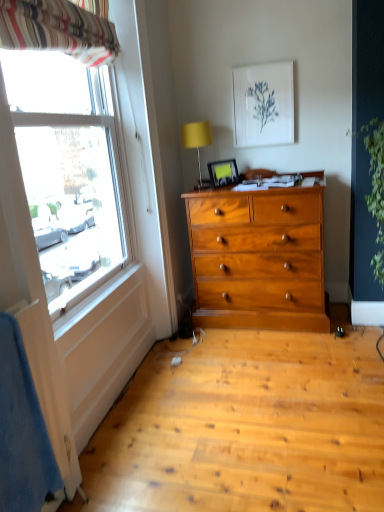
Question: Is striped fabric curtain at upper left facing towards yellow fabric lampshade at upper center?

Choices:
 (A) no
 (B) yes

Answer: (A)

Question: Is the position of striped fabric curtain at upper left more distant than that of yellow fabric lampshade at upper center?

Choices:
 (A) no
 (B) yes

Answer: (A)

Question: Does striped fabric curtain at upper left lie in front of yellow fabric lampshade at upper center?

Choices:
 (A) no
 (B) yes

Answer: (B)

Question: Can you confirm if striped fabric curtain at upper left is thinner than yellow fabric lampshade at upper center?

Choices:
 (A) yes
 (B) no

Answer: (A)

Question: Is striped fabric curtain at upper left at the right side of yellow fabric lampshade at upper center?

Choices:
 (A) yes
 (B) no

Answer: (B)

Question: From a real-world perspective, is green leafy plant at right physically located above or below matte plastic picture frame at upper center, marked as the first picture frame in a left-to-right arrangement?

Choices:
 (A) above
 (B) below

Answer: (B)

Question: Considering the positions of point (375, 168) and point (230, 169), is point (375, 168) closer or farther from the camera than point (230, 169)?

Choices:
 (A) farther
 (B) closer

Answer: (B)

Question: From the image's perspective, is green leafy plant at right above or below matte plastic picture frame at upper center, which appears as the 1th picture frame when ordered from the bottom?

Choices:
 (A) below
 (B) above

Answer: (A)

Question: Is green leafy plant at right spatially inside matte plastic picture frame at upper center, marked as the first picture frame in a left-to-right arrangement, or outside of it?

Choices:
 (A) outside
 (B) inside

Answer: (A)

Question: From a real-world perspective, is white paper at upper center, acting as the second picture frame starting from the bottom, positioned above or below striped fabric curtain at upper left?

Choices:
 (A) below
 (B) above

Answer: (A)

Question: Relative to striped fabric curtain at upper left, is white paper at upper center, acting as the second picture frame starting from the bottom, in front or behind?

Choices:
 (A) behind
 (B) front

Answer: (A)

Question: From their relative heights in the image, would you say white paper at upper center, acting as the second picture frame starting from the bottom, is taller or shorter than striped fabric curtain at upper left?

Choices:
 (A) tall
 (B) short

Answer: (A)

Question: Would you say white paper at upper center, positioned as the first picture frame in top-to-bottom order, is inside or outside striped fabric curtain at upper left?

Choices:
 (A) inside
 (B) outside

Answer: (B)

Question: Is point (233, 182) closer or farther from the camera than point (238, 86)?

Choices:
 (A) closer
 (B) farther

Answer: (B)

Question: Based on their sizes in the image, would you say matte plastic picture frame at upper center, which ranks as the second picture frame in top-to-bottom order, is bigger or smaller than white paper at upper center, the 1th picture frame positioned from the right?

Choices:
 (A) big
 (B) small

Answer: (B)